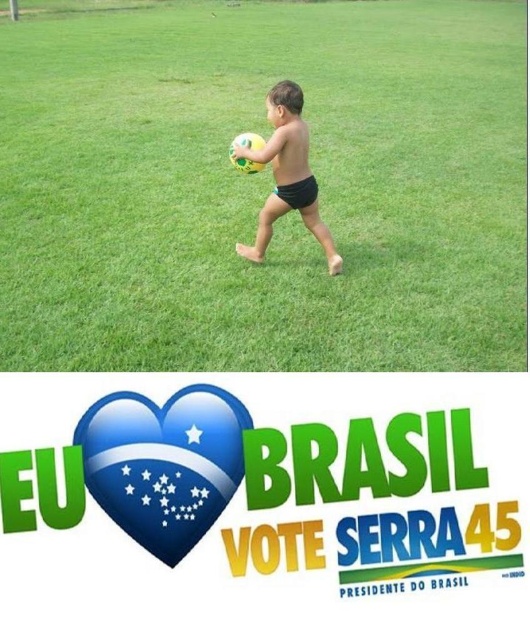
Question: Is green grass at center smaller than matte yellow ball at center?

Choices:
 (A) yes
 (B) no

Answer: (B)

Question: Which of the following is the farthest from the observer?

Choices:
 (A) (296, 136)
 (B) (38, 237)
 (C) (148, 540)

Answer: (B)

Question: Which point appears closest to the camera in this image?

Choices:
 (A) (225, 417)
 (B) (330, 266)

Answer: (A)

Question: Which object appears closest to the camera in this image?

Choices:
 (A) blue glossy heart at center
 (B) green grass at center
 (C) matte yellow ball at center

Answer: (A)

Question: Does blue glossy heart at center appear on the left side of matte yellow ball at center?

Choices:
 (A) no
 (B) yes

Answer: (B)

Question: Observing the image, what is the correct spatial positioning of blue glossy heart at center in reference to matte yellow ball at center?

Choices:
 (A) below
 (B) above

Answer: (A)